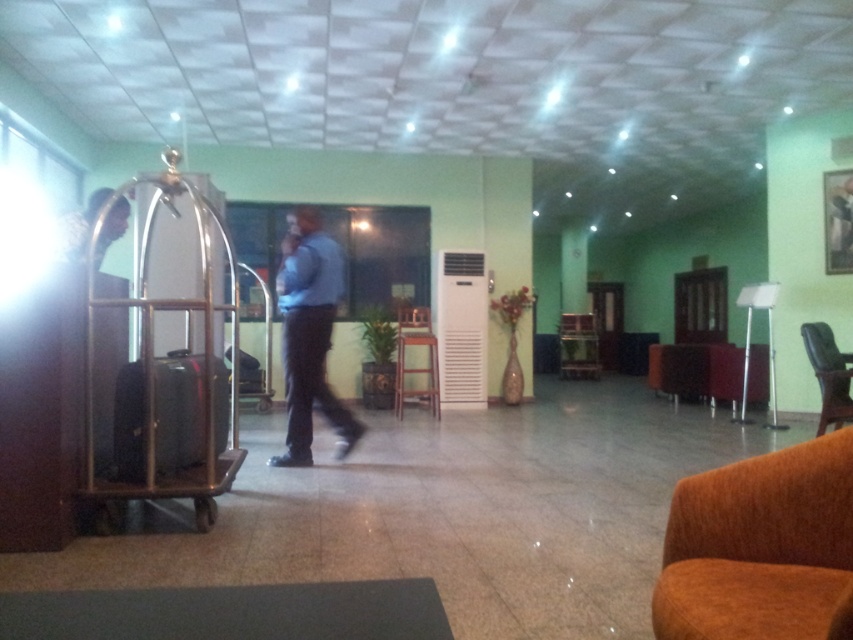
Can you confirm if brown leather armchair at lower right is thinner than brown fabric armchair at center?

Incorrect, brown leather armchair at lower right's width is not less than brown fabric armchair at center's.

Is brown leather armchair at lower right below brown fabric armchair at center?

No.

Where is `brown leather armchair at lower right`? brown leather armchair at lower right is located at coordinates (828, 374).

Is point (152, 385) farther from viewer compared to point (321, 358)?

No, (152, 385) is in front of (321, 358).

Which of these two, silver metallic luggage cart at left or blue shirt at center, stands taller?

silver metallic luggage cart at left is taller.

Describe the element at coordinates (155, 364) in the screenshot. The height and width of the screenshot is (640, 853). I see `silver metallic luggage cart at left` at that location.

Find the location of a particular element. silver metallic luggage cart at left is located at coordinates (155, 364).

In the scene shown: Is silver metallic luggage cart at left above light brown leather jacket at left?

No.

Is silver metallic luggage cart at left thinner than light brown leather jacket at left?

No, silver metallic luggage cart at left is not thinner than light brown leather jacket at left.

Is point (231, 468) positioned before point (77, 234)?

No.

This screenshot has width=853, height=640. I want to click on silver metallic luggage cart at left, so click(155, 364).